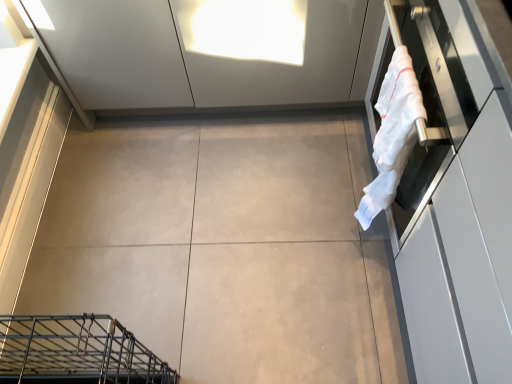
Image resolution: width=512 pixels, height=384 pixels. What are the coordinates of `gray matte concrete at center` in the screenshot? It's located at [x=225, y=247].

Describe the element at coordinates (225, 247) in the screenshot. I see `gray matte concrete at center` at that location.

Where is `white cotton towel at right`? white cotton towel at right is located at coordinates (392, 134).

The width and height of the screenshot is (512, 384). Identify the location of gray matte concrete at center. (225, 247).

Considering the relative sizes of white cotton towel at right and white glossy oven at right in the image provided, is white cotton towel at right smaller than white glossy oven at right?

Yes, white cotton towel at right is smaller than white glossy oven at right.

Can you confirm if white cotton towel at right is shorter than white glossy oven at right?

Indeed, white cotton towel at right has a lesser height compared to white glossy oven at right.

From the picture: How different are the orientations of white cotton towel at right and white glossy oven at right in degrees?

The angle between the facing direction of white cotton towel at right and the facing direction of white glossy oven at right is 0.0769 degrees.

Is white cotton towel at right directly adjacent to white glossy oven at right?

No, white cotton towel at right is not with white glossy oven at right.

Is gray matte concrete at center positioned with its back to white glossy oven at right?

No, white glossy oven at right is not at the back of gray matte concrete at center.

Between gray matte concrete at center and white glossy oven at right, which one has more height?

Standing taller between the two is white glossy oven at right.

From the image's perspective, which is below, gray matte concrete at center or white glossy oven at right?

From the image's view, white glossy oven at right is below.

Who is smaller, gray matte concrete at center or white glossy oven at right?

Smaller between the two is gray matte concrete at center.

At what (x,y) coordinates should I click in order to perform the action: click on concrete that appears behind the white cotton towel at right. Please return your answer as a coordinate pair (x, y). The image size is (512, 384). Looking at the image, I should click on (225, 247).

Is point (377, 213) closer or farther from the camera than point (152, 122)?

Point (377, 213) appears to be closer to the viewer than point (152, 122).

Is white cotton towel at right further to the viewer compared to gray matte concrete at center?

No, the depth of white cotton towel at right is less than that of gray matte concrete at center.

Are white glossy oven at right and gray matte concrete at center beside each other?

No, white glossy oven at right is not with gray matte concrete at center.

In the image, is white glossy oven at right positioned in front of or behind gray matte concrete at center?

white glossy oven at right is positioned closer to the viewer than gray matte concrete at center.

From a real-world perspective, is white glossy oven at right positioned under gray matte concrete at center based on gravity?

No, from a real-world perspective, white glossy oven at right is not under gray matte concrete at center.

Which is correct: white glossy oven at right is inside gray matte concrete at center, or outside of it?

white glossy oven at right is not inside gray matte concrete at center, it's outside.

Considering the points (81, 201) and (411, 84), which point is behind, point (81, 201) or point (411, 84)?

The point (81, 201) is farther.

Is gray matte concrete at center in contact with white cotton towel at right?

No, gray matte concrete at center is not next to white cotton towel at right.

Who is shorter, gray matte concrete at center or white cotton towel at right?

Standing shorter between the two is gray matte concrete at center.

Would you say white glossy oven at right is a long distance from white cotton towel at right?

They are positioned close to each other.

Considering the positions of objects white glossy oven at right and white cotton towel at right in the image provided, who is more to the right, white glossy oven at right or white cotton towel at right?

Positioned to the right is white glossy oven at right.

Who is shorter, white glossy oven at right or white cotton towel at right?

Standing shorter between the two is white cotton towel at right.

Is point (425, 193) farther from viewer compared to point (395, 137)?

No, it is in front of (395, 137).

This screenshot has width=512, height=384. I want to click on laundry below the white glossy oven at right (from a real-world perspective), so click(x=392, y=134).

Find the location of `cabinetry on the right of gray matte concrete at center`. cabinetry on the right of gray matte concrete at center is located at coordinates (457, 202).

Which object lies further to the anchor point white cotton towel at right, white glossy oven at right or gray matte concrete at center?

The object further to white cotton towel at right is gray matte concrete at center.

When comparing their distances from white cotton towel at right, does gray matte concrete at center or white glossy oven at right seem closer?

The object closer to white cotton towel at right is white glossy oven at right.

Estimate the real-world distances between objects in this image. Which object is closer to white glossy oven at right, gray matte concrete at center or white cotton towel at right?

Based on the image, white cotton towel at right appears to be nearer to white glossy oven at right.

When comparing their distances from gray matte concrete at center, does white cotton towel at right or white glossy oven at right seem further?

Among the two, white glossy oven at right is located further to gray matte concrete at center.

Considering their positions, is white cotton towel at right positioned further to white glossy oven at right than gray matte concrete at center?

Among the two, gray matte concrete at center is located further to white glossy oven at right.

From the image, which object appears to be farther from gray matte concrete at center, white glossy oven at right or white cotton towel at right?

white glossy oven at right is positioned further to the anchor gray matte concrete at center.

Find the location of `laundry between white glossy oven at right and gray matte concrete at center along the z-axis`. laundry between white glossy oven at right and gray matte concrete at center along the z-axis is located at coordinates (392, 134).